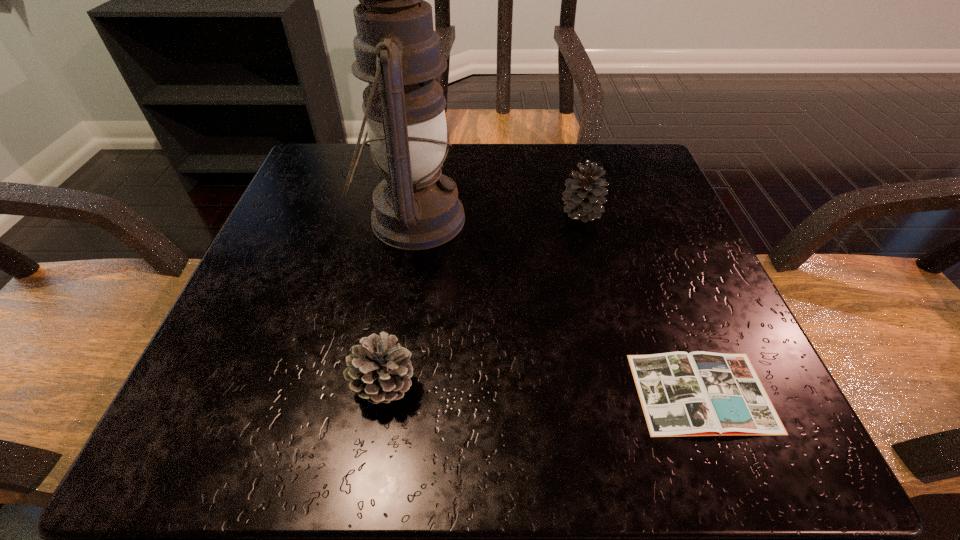
At what (x,y) coordinates should I click in order to perform the action: click on free space in the image that satisfies the following two spatial constraints: 1. on the back side of the nearer pinecone; 2. on the right side of the oil lamp. Please return your answer as a coordinate pair (x, y). Looking at the image, I should click on [412, 219].

You are a GUI agent. You are given a task and a screenshot of the screen. Output one action in this format:
    pyautogui.click(x=<x>, y=<y>)
    Task: Click on the vacant space that satisfies the following two spatial constraints: 1. on the back side of the tallest object; 2. on the left side of the taller pinecone
    The height and width of the screenshot is (540, 960).
    Given the screenshot: What is the action you would take?
    pyautogui.click(x=414, y=213)